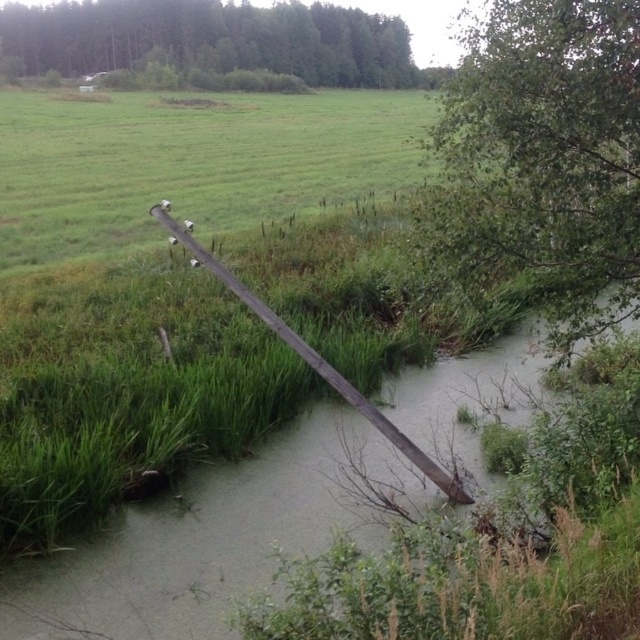
You are standing at the edge of the water and want to walk to the green leafy tree at lower right. Is the wooden pole at center in your way?

The green leafy tree at lower right is to the right of the wooden pole at center, so the wooden pole at center is not directly in your path. However, you might need to walk around it depending on your exact route.

You are standing at the edge of the water and want to walk to the green leafy tree at upper center. There is a green leafy tree at lower right blocking your path. Since the tree at lower right is narrower than the one at upper center, can you walk around it to reach your destination?

The green leafy tree at lower right is narrower than the green leafy tree at upper center, so yes, you can walk around the green leafy tree at lower right to reach the green leafy tree at upper center.